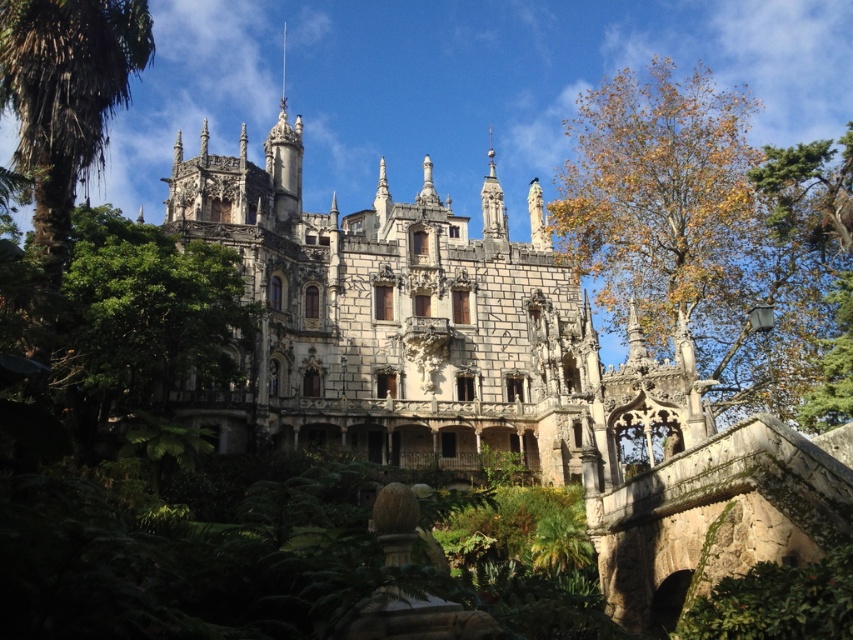
Question: Is stone castle at center further to the viewer compared to green leafy palm at upper left?

Choices:
 (A) no
 (B) yes

Answer: (B)

Question: Considering the real-world distances, which object is farthest from the stone castle at center?

Choices:
 (A) yellow-green leaves at upper right
 (B) green leafy palm at upper left

Answer: (B)

Question: Does yellow-green leaves at upper right appear over green leafy palm at upper left?

Choices:
 (A) yes
 (B) no

Answer: (A)

Question: Which is farther from the green leafy palm at upper left?

Choices:
 (A) yellow-green leaves at upper right
 (B) stone castle at center

Answer: (A)

Question: Which is nearer to the stone castle at center?

Choices:
 (A) green leafy palm at upper left
 (B) yellow-green leaves at upper right

Answer: (B)

Question: From the image, what is the correct spatial relationship of stone castle at center in relation to yellow-green leaves at upper right?

Choices:
 (A) below
 (B) above

Answer: (A)